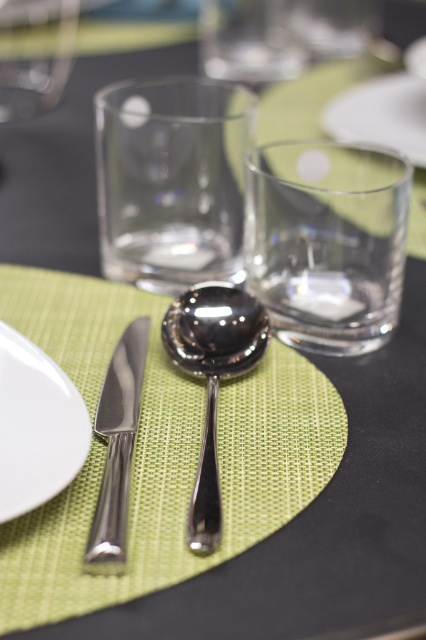
Question: Is white glossy plate at lower left to the right of white matte plate at upper center from the viewer's perspective?

Choices:
 (A) yes
 (B) no

Answer: (B)

Question: Estimate the real-world distances between objects in this image. Which object is closer to the transparent glass at center?

Choices:
 (A) polished silver spoon at center
 (B) white matte plate at upper center
 (C) polished metal knife at left

Answer: (A)

Question: Among these points, which one is farthest from the camera?

Choices:
 (A) coord(256,282)
 (B) coord(14,513)
 (C) coord(100,525)

Answer: (A)

Question: Does polished metal knife at left have a greater width compared to white matte plate at upper center?

Choices:
 (A) no
 (B) yes

Answer: (A)

Question: Can you confirm if transparent glass at center is positioned to the right of polished silver spoon at center?

Choices:
 (A) yes
 (B) no

Answer: (A)

Question: Among these objects, which one is nearest to the camera?

Choices:
 (A) polished silver spoon at center
 (B) polished metal knife at left
 (C) transparent glass at center

Answer: (B)